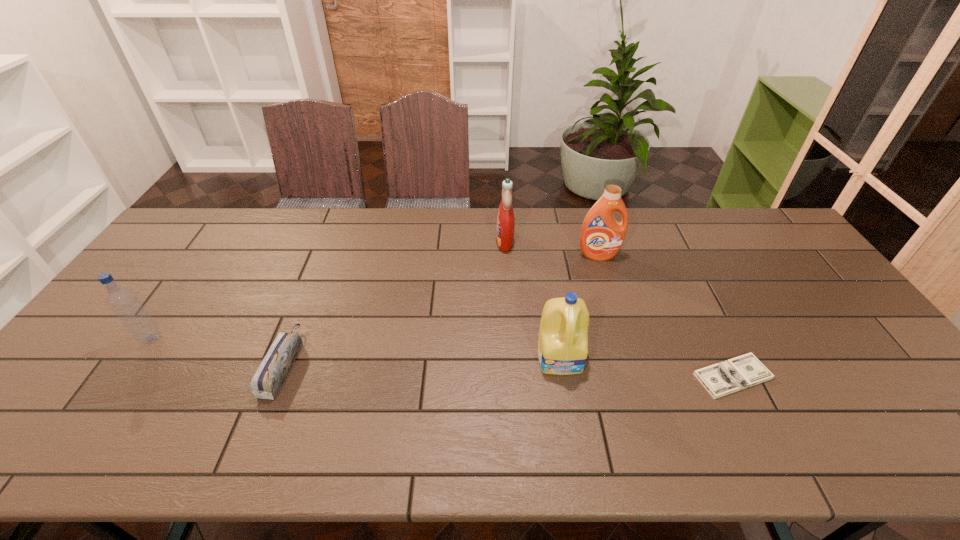
You are a GUI agent. You are given a task and a screenshot of the screen. Output one action in this format:
    pyautogui.click(x=<x>, y=<y>)
    Task: Click on the vacant space at the near left corner of the desktop
    
    Given the screenshot: What is the action you would take?
    pyautogui.click(x=20, y=435)

The image size is (960, 540). What are the coordinates of `empty space between the second shortest object and the water bottle` in the screenshot? It's located at (218, 352).

The image size is (960, 540). I want to click on free area in between the rightmost object and the leftmost detergent, so click(618, 308).

Locate an element on the screen. Image resolution: width=960 pixels, height=540 pixels. free space between the rightmost object and the rightmost detergent is located at coordinates (665, 315).

Image resolution: width=960 pixels, height=540 pixels. I want to click on free space between the nearest detergent and the third object from left to right, so click(x=533, y=299).

Find the location of a particular element. blank region between the shortest object and the nearest detergent is located at coordinates (647, 367).

Identify the location of blank region between the fifth tallest object and the leftmost object. (218, 352).

The height and width of the screenshot is (540, 960). I want to click on blank region between the leftmost detergent and the leftmost object, so click(328, 290).

The image size is (960, 540). I want to click on free space between the shortest object and the pencil box, so click(508, 370).

Where is `free space between the second detergent from right to left and the pencil box`? The width and height of the screenshot is (960, 540). free space between the second detergent from right to left and the pencil box is located at coordinates (422, 361).